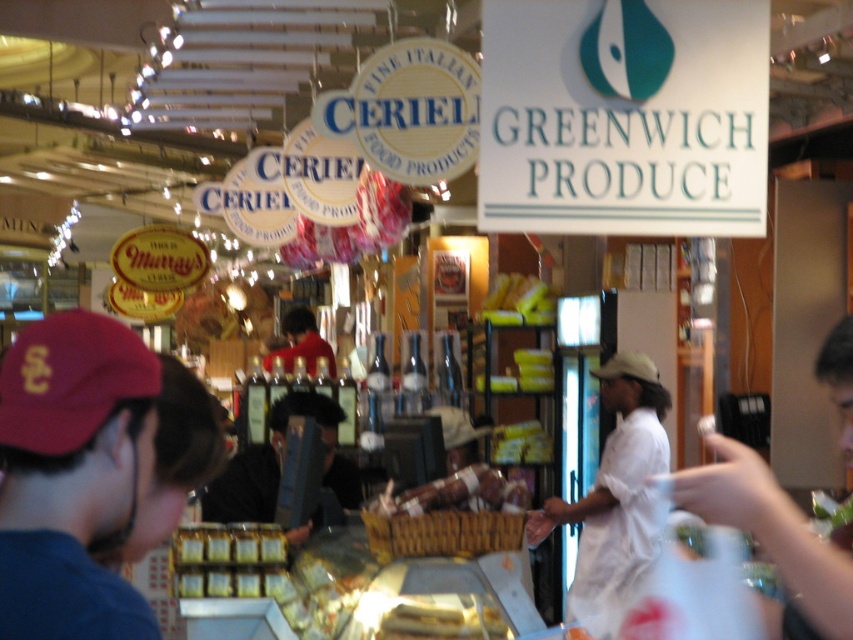
You are a customer in the market and want to place a small item on the maroon fabric cap at left and the black fabric at center. Which surface can accommodate a larger item?

The black fabric at center can accommodate a larger item because it has a bigger size than the maroon fabric cap at left.

You are a photographer trying to capture both the white cotton shirt at center and the matte red shirt at center in a single frame. Which shirt should you focus on to ensure both are in the frame without zooming in or out?

You should focus on the white cotton shirt at center because it has a smaller width than the matte red shirt at center, allowing both to fit within the frame more easily.